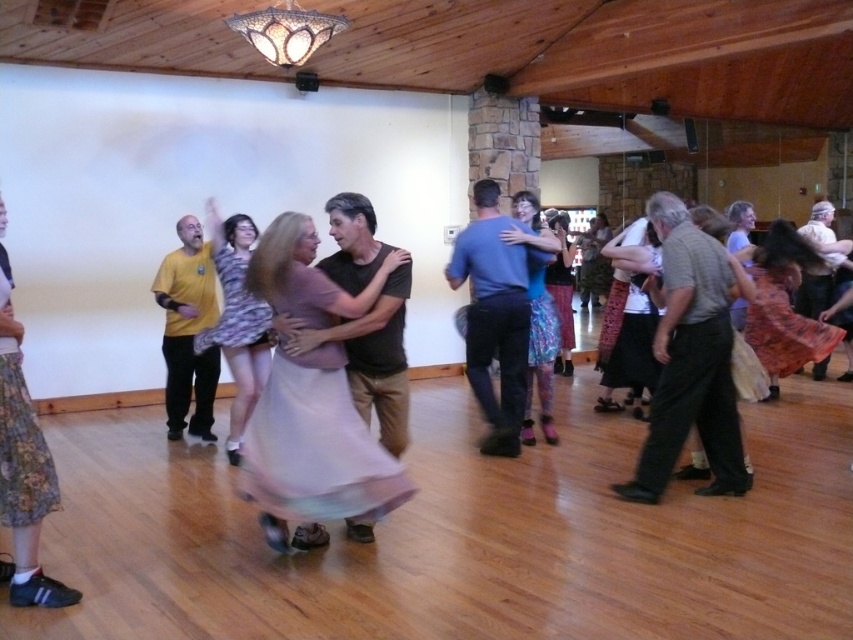
Question: Does blue cotton shirt at center appear under floral skirt at left?

Choices:
 (A) yes
 (B) no

Answer: (B)

Question: Which of the following is the closest to the observer?

Choices:
 (A) (33, 518)
 (B) (511, 387)

Answer: (A)

Question: Is the position of blue cotton shirt at center more distant than that of floral skirt at left?

Choices:
 (A) no
 (B) yes

Answer: (B)

Question: Can you confirm if blue cotton shirt at center is positioned to the right of floral skirt at left?

Choices:
 (A) no
 (B) yes

Answer: (B)

Question: Which point appears farthest from the camera in this image?

Choices:
 (A) (519, 340)
 (B) (56, 481)

Answer: (A)